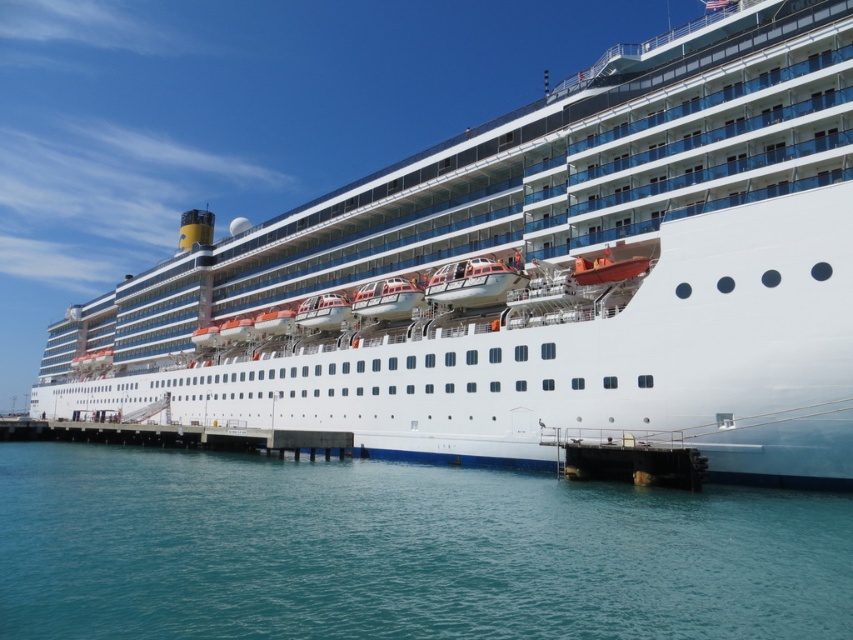
You are standing on the pier looking at the cruise ship. There are two points marked on the ship. The first point is at coordinates point (338, 490) and the second point is at point (274, 440). Which point is closer to you?

Point (338, 490) is in front of point (274, 440), so it is closer to you.

You are a photographer planning to take a photo of the white glossy cruise ship at center and the clear blue water at lower center. Which object will occupy more space in the photo?

The white glossy cruise ship at center will occupy more space in the photo because it has a larger size compared to the clear blue water at lower center.

You are a tour guide explaining the docking process to a group. You mention the white glossy cruise ship at center and the white concrete dock at lower center. Which one is wider?

The white glossy cruise ship at center is wider than the white concrete dock at lower center.